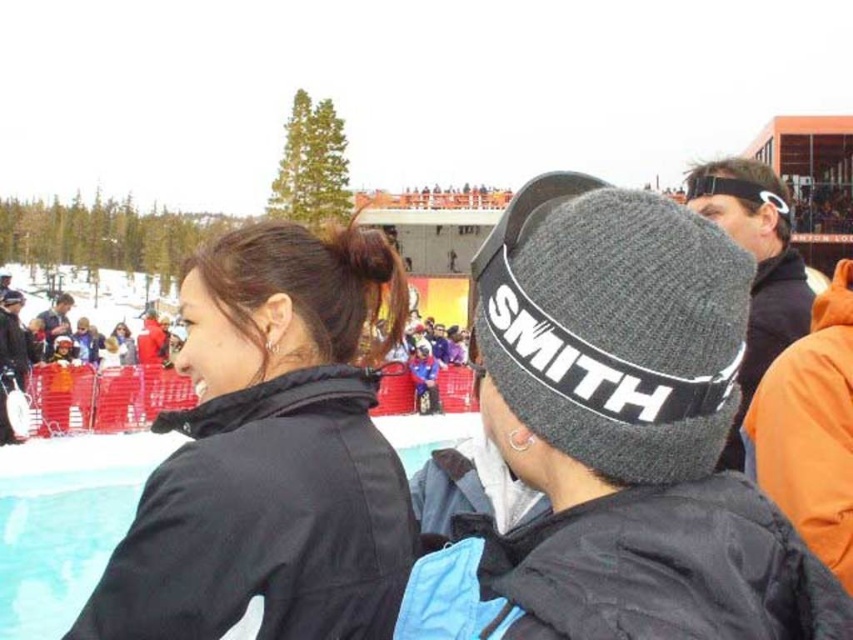
You are standing at the point labeled point [257,282] and want to move to the point labeled point [683,561]. Which direction should you move in relation to the camera?

You should move away from the camera to reach point [683,561] from point [257,282] because point [683,561] is closer to the camera than point [257,282].

You are a photographer trying to capture a clear shot of the knit gray beanie at center and the black matte jacket at left. Which object should you focus on first to ensure both are in focus?

The knit gray beanie at center is closer to the viewer than the black matte jacket at left. To ensure both are in focus, you should focus on the black matte jacket at left first, as it is farther away, allowing the depth of field to cover both objects.

You are a photographer trying to capture both the knit gray beanie at center and the black matte jacket at left in the same frame. Based on their positions, which object is closer to the right edge of the photo?

The knit gray beanie at center is positioned on the right side of the black matte jacket at left, so it is closer to the right edge of the photo.